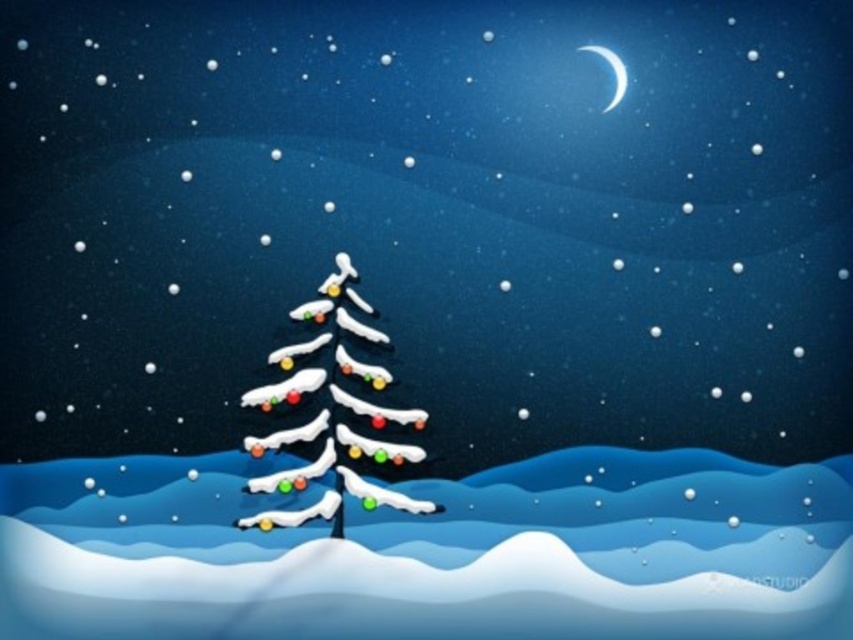
How much distance is there between icy white christmas tree at center and white glossy crescent moon at upper right?

icy white christmas tree at center is 55.35 centimeters away from white glossy crescent moon at upper right.

Is point (374, 506) more distant than point (613, 51)?

No, (374, 506) is in front of (613, 51).

Is point (355, 490) positioned before point (618, 92)?

Yes, it is.

At what (x,y) coordinates should I click in order to perform the action: click on icy white christmas tree at center. Please return your answer as a coordinate pair (x, y). This screenshot has height=640, width=853. Looking at the image, I should click on (331, 413).